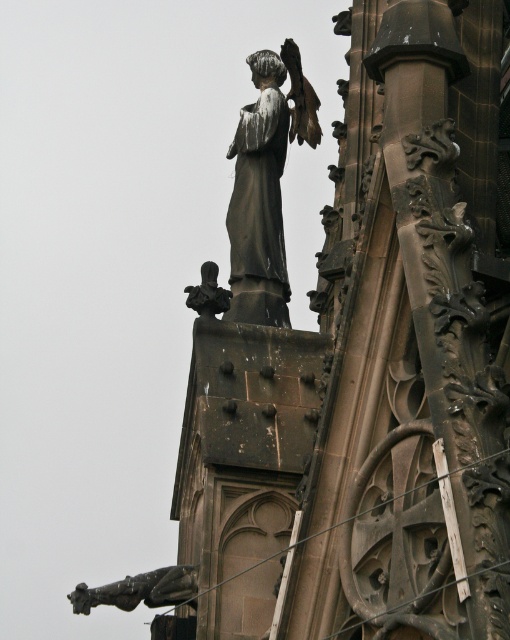
Does bronze statue at upper center appear under polished bronze statue at lower left?

No.

Is point (244, 129) farther from viewer compared to point (112, 598)?

Yes, it is.

Does point (242, 260) come in front of point (157, 588)?

No, (242, 260) is further to viewer.

The image size is (510, 640). I want to click on bronze statue at upper center, so click(266, 186).

Which of these two, dark brown stone statue at upper center or bronze statue at upper center, stands taller?

dark brown stone statue at upper center is taller.

Is dark brown stone statue at upper center shorter than bronze statue at upper center?

No, dark brown stone statue at upper center is not shorter than bronze statue at upper center.

Which is behind, point (444, 362) or point (253, 61)?

Point (253, 61)

Find the location of `dark brown stone statue at upper center`. dark brown stone statue at upper center is located at coordinates (372, 368).

Can you confirm if dark brown stone statue at upper center is bigger than polished bronze statue at lower left?

Correct, dark brown stone statue at upper center is larger in size than polished bronze statue at lower left.

Who is more distant from viewer, (505, 189) or (185, 572)?

The point (185, 572) is more distant.

Identify the location of dark brown stone statue at upper center. (372, 368).